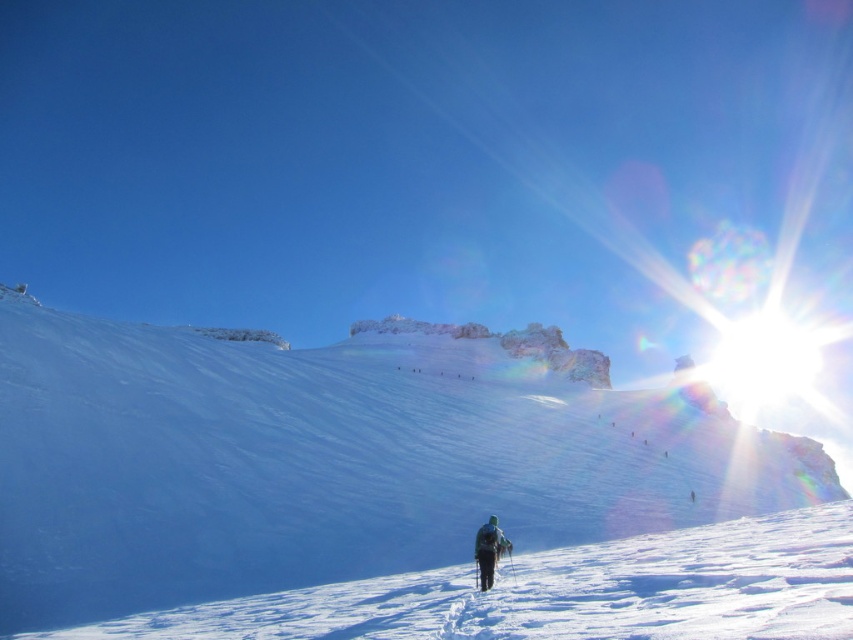
Is white powdery snow at center to the left of dark green fabric jacket at lower center from the viewer's perspective?

In fact, white powdery snow at center is to the right of dark green fabric jacket at lower center.

Who is taller, white powdery snow at center or dark green fabric jacket at lower center?

white powdery snow at center is taller.

Describe the element at coordinates (334, 458) in the screenshot. I see `white powdery snow at center` at that location.

Where is `white powdery snow at center`? white powdery snow at center is located at coordinates (334, 458).

Is point (410, 605) positioned in front of point (496, 538)?

Yes, it is in front of point (496, 538).

Which is below, white snow at center or dark green fabric jacket at lower center?

Positioned lower is dark green fabric jacket at lower center.

Is point (354, 600) farther from viewer compared to point (500, 544)?

No, (354, 600) is closer to viewer.

The image size is (853, 640). I want to click on white snow at center, so click(564, 593).

At what (x,y) coordinates should I click in order to perform the action: click on white powdery snow at center. Please return your answer as a coordinate pair (x, y). This screenshot has height=640, width=853. Looking at the image, I should click on (334, 458).

Does white powdery snow at center have a smaller size compared to white snow at center?

Actually, white powdery snow at center might be larger than white snow at center.

The height and width of the screenshot is (640, 853). Identify the location of white powdery snow at center. (334, 458).